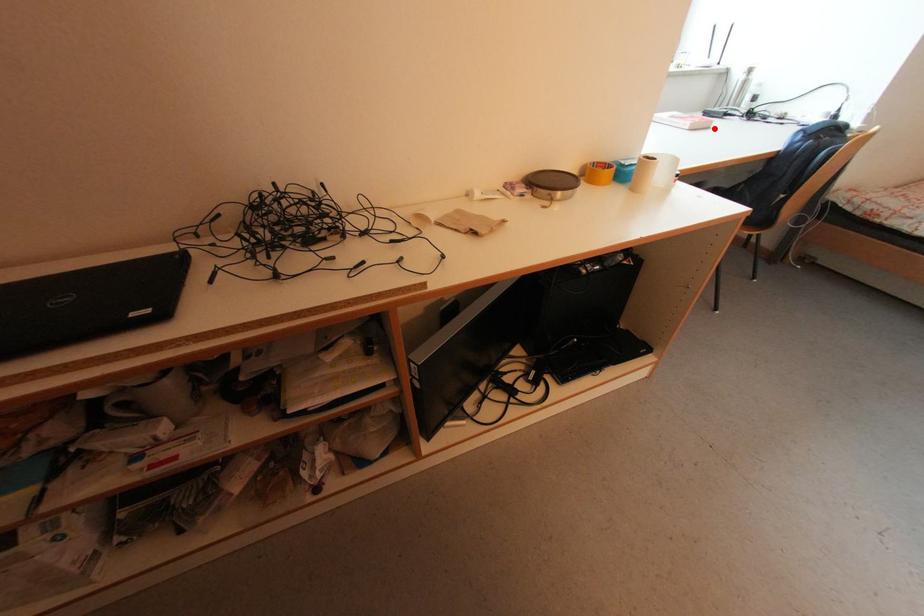
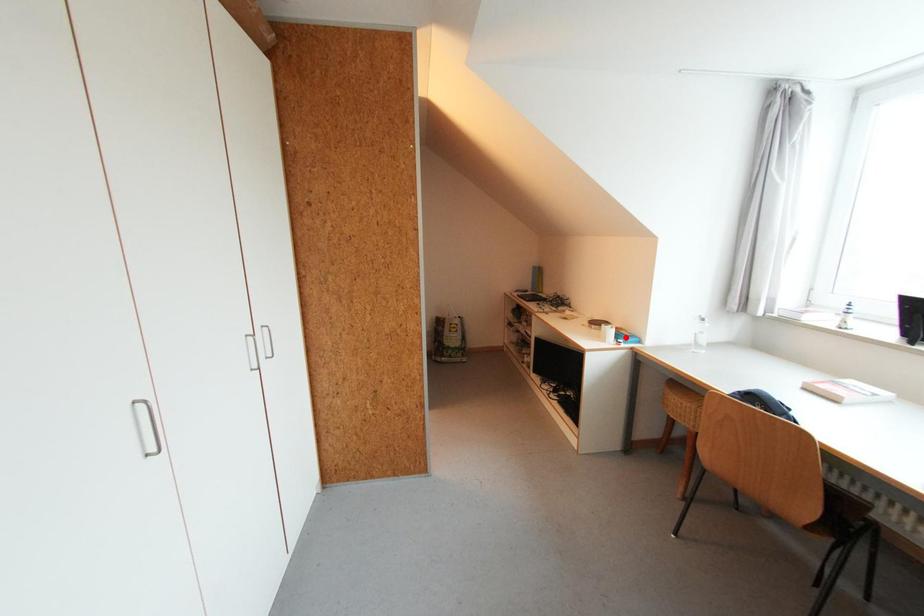
I am providing you with two images of the same scene from different viewpoints. A red point is marked on the first image and another point is marked on the second image. Is the red point in image1 aligned with the point shown in image2?

No